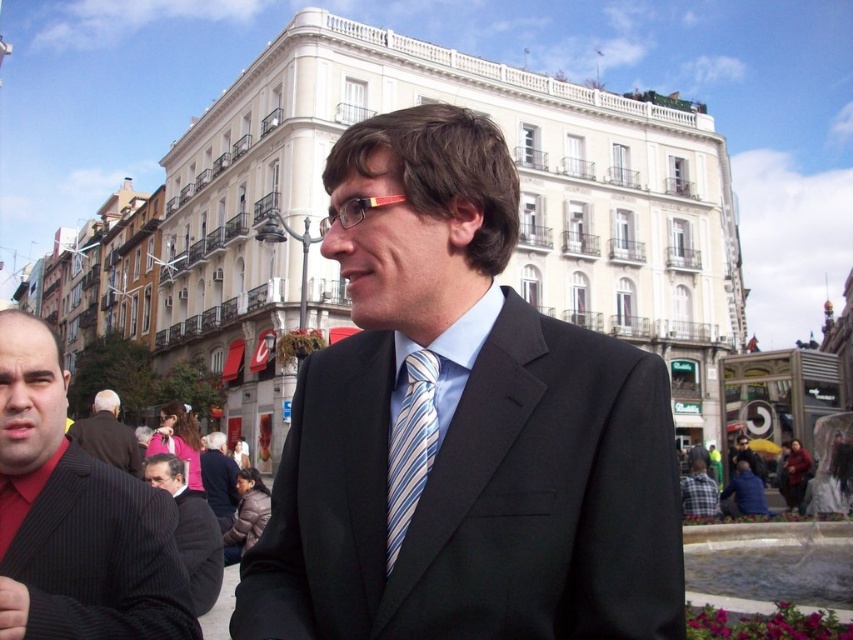
You are a fashion designer observing a man in an urban setting. You notice the blue striped tie at center and the dark brown suit at left. How far apart are these two items on the man?

The blue striped tie at center and dark brown suit at left are 17.91 meters apart.

You are a photographer standing at the camera position. You want to take a closeup shot of the dark gray pinstripe suit at lower left. Given that your camera has a maximum zoom range of 25 meters, can you capture the subject clearly?

The dark gray pinstripe suit at lower left is 27.40 meters from camera. Since the camera can only zoom up to 25 meters, it cannot capture the subject clearly at that distance.